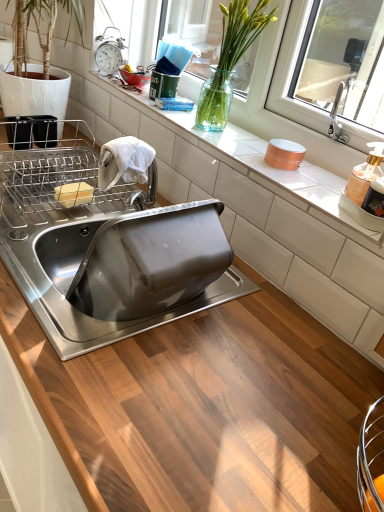
The image size is (384, 512). In order to click on white glossy countertop at center in this screenshot , I will do `click(263, 211)`.

Where is `translucent glass vase at upper center`? Image resolution: width=384 pixels, height=512 pixels. translucent glass vase at upper center is located at coordinates click(230, 60).

Describe the element at coordinates (230, 60) in the screenshot. The image size is (384, 512). I see `translucent glass vase at upper center` at that location.

The height and width of the screenshot is (512, 384). Find the location of `transparent glass vase at upper center`. transparent glass vase at upper center is located at coordinates (324, 66).

What are the coordinates of `translucent plastic soap dispenser at right` in the screenshot? It's located at (363, 189).

Measure the distance between translucent plastic soap dispenser at right and camera.

translucent plastic soap dispenser at right is 31.99 inches from camera.

This screenshot has width=384, height=512. Describe the element at coordinates (110, 52) in the screenshot. I see `metallic silver alarm clock at upper left` at that location.

Where is `white glossy countertop at center`? Image resolution: width=384 pixels, height=512 pixels. white glossy countertop at center is located at coordinates (263, 211).

Which is in front, yellow butter at upper left or translucent plastic soap dispenser at right?

Positioned in front is translucent plastic soap dispenser at right.

Is yellow butter at upper left aimed at translucent plastic soap dispenser at right?

No, yellow butter at upper left is not oriented towards translucent plastic soap dispenser at right.

At what (x,y) coordinates should I click in order to perform the action: click on appliance below the yellow butter at upper left (from the image's perspective). Please return your answer as a coordinate pair (x, y). Looking at the image, I should click on (363, 189).

From a real-world perspective, between transparent glass vase at upper center and stainless steel sink at center, who is vertically higher?

transparent glass vase at upper center.

Between transparent glass vase at upper center and stainless steel sink at center, which one has larger size?

With larger size is stainless steel sink at center.

Is the surface of transparent glass vase at upper center in direct contact with translucent plastic soap dispenser at right?

transparent glass vase at upper center is not next to translucent plastic soap dispenser at right, and they're not touching.

Locate an element on the screen. The width and height of the screenshot is (384, 512). window screen behind the translucent plastic soap dispenser at right is located at coordinates (324, 66).

Which is behind, point (304, 96) or point (346, 196)?

Positioned behind is point (304, 96).

From a real-world perspective, which is physically above, transparent glass vase at upper center or translucent plastic soap dispenser at right?

transparent glass vase at upper center, from a real-world perspective.

Does point (107, 71) appear closer or farther from the camera than point (209, 106)?

Point (107, 71) appears to be farther away from the viewer than point (209, 106).

Would you say metallic silver alarm clock at upper left is outside translucent glass vase at upper center?

Yes.

The height and width of the screenshot is (512, 384). Identify the location of flower above the metallic silver alarm clock at upper left (from a real-world perspective). (x=230, y=60).

Is metallic silver alarm clock at upper left bigger than translucent glass vase at upper center?

Incorrect, metallic silver alarm clock at upper left is not larger than translucent glass vase at upper center.

Looking at this image, is translucent glass vase at upper center looking in the opposite direction of translucent plastic soap dispenser at right?

No.

What's the angular difference between translucent glass vase at upper center and translucent plastic soap dispenser at right's facing directions?

They differ by 20 degrees in their facing directions.

From the image's perspective, which is below, translucent glass vase at upper center or translucent plastic soap dispenser at right?

translucent plastic soap dispenser at right, from the image's perspective.

In terms of height, does translucent glass vase at upper center look taller or shorter compared to translucent plastic soap dispenser at right?

Clearly, translucent glass vase at upper center is taller compared to translucent plastic soap dispenser at right.

Is white glossy countertop at center bigger than yellow butter at upper left?

Indeed, white glossy countertop at center has a larger size compared to yellow butter at upper left.

Does point (186, 195) appear closer or farther from the camera than point (84, 201)?

Point (186, 195) is farther from the camera than point (84, 201).

I want to click on countertop in front of the yellow butter at upper left, so click(263, 211).

Considering the relative sizes of translucent plastic soap dispenser at right and white glossy countertop at center in the image provided, is translucent plastic soap dispenser at right shorter than white glossy countertop at center?

Indeed, translucent plastic soap dispenser at right has a lesser height compared to white glossy countertop at center.

Is translucent plastic soap dispenser at right further to camera compared to white glossy countertop at center?

Yes, the depth of translucent plastic soap dispenser at right is greater than that of white glossy countertop at center.

You are a GUI agent. You are given a task and a screenshot of the screen. Output one action in this format:
    pyautogui.click(x=<x>, y=<y>)
    Task: Click on the countertop above the translucent plastic soap dispenser at right (from the image's perspective)
    Image resolution: width=384 pixels, height=512 pixels.
    Given the screenshot: What is the action you would take?
    pyautogui.click(x=263, y=211)

Would you say translucent plastic soap dispenser at right contains white glossy countertop at center?

No, white glossy countertop at center is located outside of translucent plastic soap dispenser at right.

The width and height of the screenshot is (384, 512). In order to click on appliance on the right of yellow butter at upper left in this screenshot , I will do `click(363, 189)`.

At what (x,y) coordinates should I click in order to perform the action: click on sink beneath the transparent glass vase at upper center (from a real-world perspective). Please return your answer as a coordinate pair (x, y). The height and width of the screenshot is (512, 384). Looking at the image, I should click on (107, 251).

Which object lies further to the anchor point translucent plastic soap dispenser at right, stainless steel sink at center or yellow butter at upper left?

yellow butter at upper left is positioned further to the anchor translucent plastic soap dispenser at right.

Looking at the image, which one is located closer to translucent glass vase at upper center, transparent glass vase at upper center or translucent plastic soap dispenser at right?

Among the two, transparent glass vase at upper center is located nearer to translucent glass vase at upper center.

Considering their positions, is yellow butter at upper left positioned closer to white glossy countertop at center than translucent plastic soap dispenser at right?

translucent plastic soap dispenser at right is closer to white glossy countertop at center.

Which object lies further to the anchor point transparent glass vase at upper center, translucent glass vase at upper center or yellow butter at upper left?

yellow butter at upper left lies further to transparent glass vase at upper center than the other object.

From the image, which object appears to be nearer to yellow butter at upper left, stainless steel sink at center or translucent plastic soap dispenser at right?

Among the two, stainless steel sink at center is located nearer to yellow butter at upper left.

Estimate the real-world distances between objects in this image. Which object is further from translucent plastic soap dispenser at right, translucent glass vase at upper center or yellow butter at upper left?

The object further to translucent plastic soap dispenser at right is yellow butter at upper left.

From the picture: Based on their spatial positions, is white glossy countertop at center or transparent glass vase at upper center further from stainless steel sink at center?

Based on the image, transparent glass vase at upper center appears to be further to stainless steel sink at center.

When comparing their distances from transparent glass vase at upper center, does white glossy countertop at center or metallic silver alarm clock at upper left seem further?

Based on the image, metallic silver alarm clock at upper left appears to be further to transparent glass vase at upper center.

Find the location of a particular element. countertop between stainless steel sink at center and metallic silver alarm clock at upper left along the z-axis is located at coordinates (263, 211).

Find the location of a particular element. Image resolution: width=384 pixels, height=512 pixels. food positioned between stainless steel sink at center and metallic silver alarm clock at upper left from near to far is located at coordinates tap(74, 194).

Identify the location of flower situated between yellow butter at upper left and transparent glass vase at upper center from left to right. (230, 60).

Image resolution: width=384 pixels, height=512 pixels. Find the location of `countertop located between stainless steel sink at center and translucent glass vase at upper center in the left-right direction`. countertop located between stainless steel sink at center and translucent glass vase at upper center in the left-right direction is located at coordinates (263, 211).